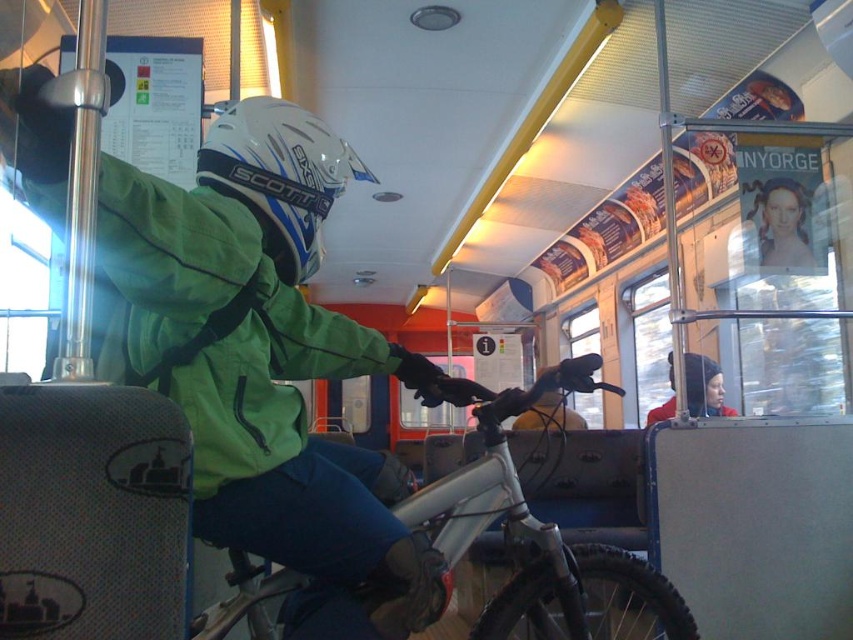
You are a tailor measuring clothing items in a store. You have a green matte jacket at upper left and a red woolen hat at upper right. Which item has a greater width?

The green matte jacket at upper left has a greater width than the red woolen hat at upper right according to the description.

You are a delivery person needing to place a rectangular box that is 1.2 meters wide into the public transportation vehicle shown. The box must be placed between the white matte bicycle at center and the red woolen hat at upper right. Can the box fit in that space?

The white matte bicycle at center is wider than the red woolen hat at upper right. Since the box is 1.2 meters wide, and the space between them may not be wide enough, it is uncertain if it will fit without more specific measurements. However, since the bicycle is wider, the space might be constrained. Please check the exact dimensions before placing the box.

You are a passenger on a train and see a person wearing a green matte jacket at upper left and a red woolen hat at upper right. Which item of clothing is larger?

The green matte jacket at upper left is bigger than the red woolen hat at upper right.